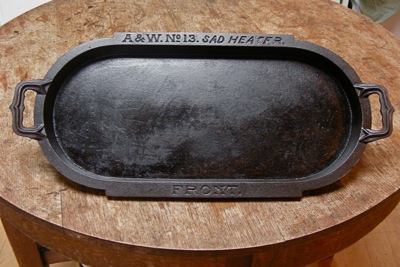
Point to visible where you hold the frying pan to place it on stove in the image. Your answer should be formatted as a list of tuples, i.e. [(x1, y1), (x2, y2), ...], where each tuple contains the x and y coordinates of a point satisfying the conditions above.

[(387, 112), (17, 106)]